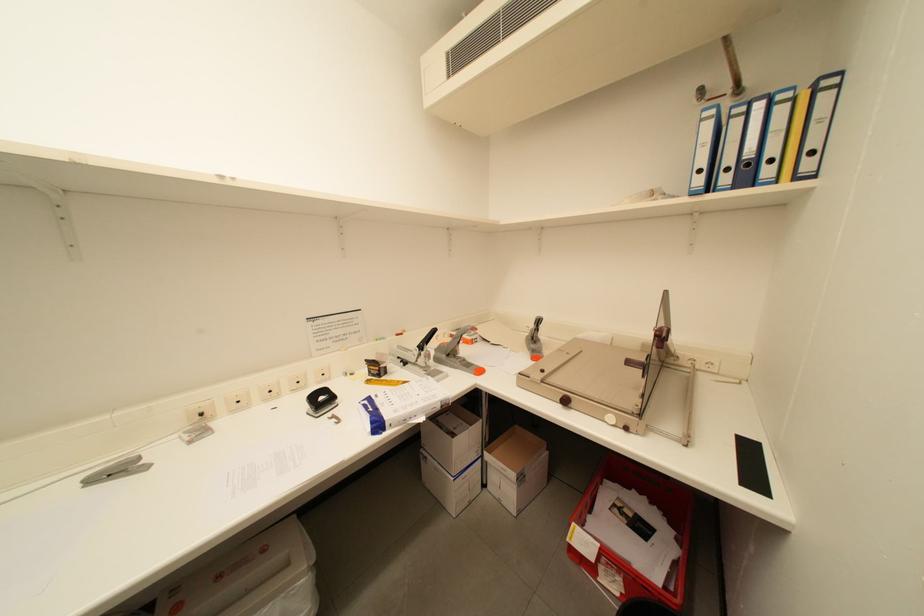
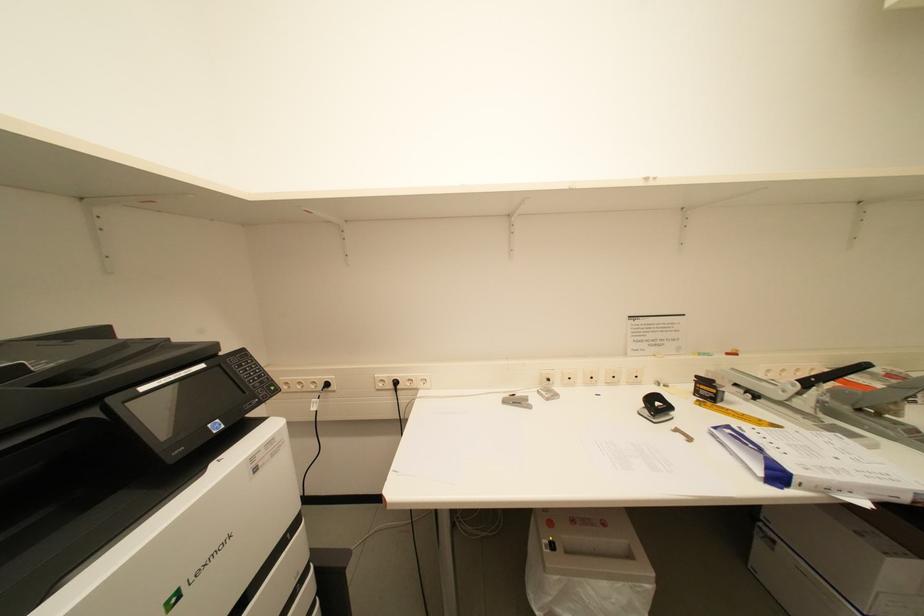
Question: The camera is either moving clockwise (left) or counter-clockwise (right) around the object. The first image is from the beginning of the video and the second image is from the end. Is the camera moving left or right when shooting the video?

Choices:
 (A) Left
 (B) Right

Answer: (B)